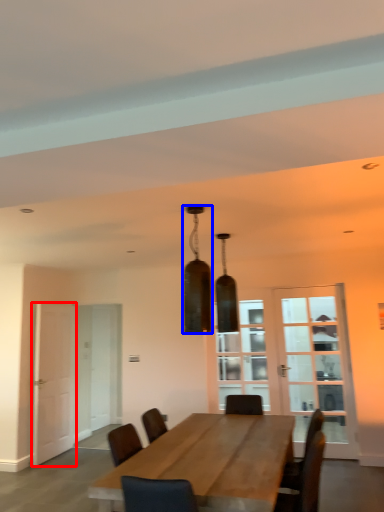
Question: Which point is further to the camera, door (highlighted by a red box) or lamp (highlighted by a blue box)?

Choices:
 (A) door
 (B) lamp

Answer: (A)